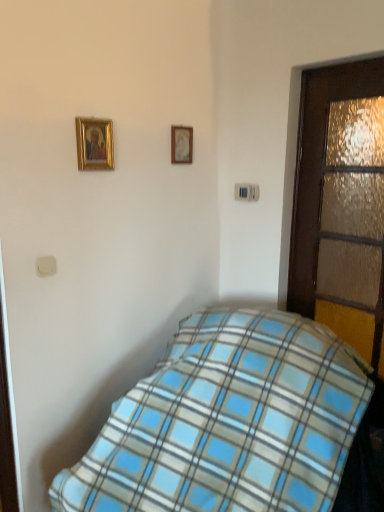
Question: Is blue plaid blanket at lower center thinner than gold-framed picture at upper left, the 1th picture frame from the left?

Choices:
 (A) no
 (B) yes

Answer: (A)

Question: From the image's perspective, is blue plaid blanket at lower center over gold-framed picture at upper left, the 2th picture frame in the back-to-front sequence?

Choices:
 (A) no
 (B) yes

Answer: (A)

Question: From the image's perspective, would you say blue plaid blanket at lower center is shown under gold-framed picture at upper left, the 2th picture frame in the right-to-left sequence?

Choices:
 (A) yes
 (B) no

Answer: (A)

Question: Is blue plaid blanket at lower center outside gold-framed picture at upper left, the 1th picture frame viewed from the front?

Choices:
 (A) yes
 (B) no

Answer: (A)

Question: Is blue plaid blanket at lower center not close to gold-framed picture at upper left, the 2th picture frame in the right-to-left sequence?

Choices:
 (A) no
 (B) yes

Answer: (B)

Question: Is gold-framed picture at upper left, the 2th picture frame in the back-to-front sequence, a part of blue plaid blanket at lower center?

Choices:
 (A) no
 (B) yes

Answer: (A)

Question: From the image's perspective, is wooden textured door at right below blue plaid blanket at lower center?

Choices:
 (A) no
 (B) yes

Answer: (A)

Question: Does wooden textured door at right appear on the left side of blue plaid blanket at lower center?

Choices:
 (A) no
 (B) yes

Answer: (A)

Question: Is wooden textured door at right bigger than blue plaid blanket at lower center?

Choices:
 (A) no
 (B) yes

Answer: (A)

Question: Is wooden textured door at right closer to camera compared to blue plaid blanket at lower center?

Choices:
 (A) yes
 (B) no

Answer: (B)

Question: Considering the relative positions of wooden textured door at right and blue plaid blanket at lower center in the image provided, is wooden textured door at right to the right of blue plaid blanket at lower center from the viewer's perspective?

Choices:
 (A) yes
 (B) no

Answer: (A)

Question: Considering the relative sizes of wooden textured door at right and blue plaid blanket at lower center in the image provided, is wooden textured door at right taller than blue plaid blanket at lower center?

Choices:
 (A) no
 (B) yes

Answer: (B)

Question: Does wooden picture frame at upper center, marked as the second picture frame in a left-to-right arrangement, have a greater height compared to wooden textured door at right?

Choices:
 (A) yes
 (B) no

Answer: (B)